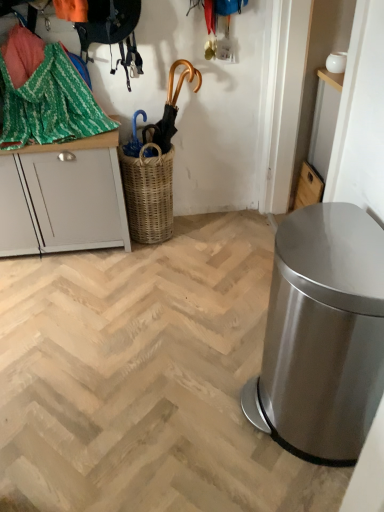
Question: From a real-world perspective, does gold metallic umbrella at upper center sit lower than green woven fabric at upper left?

Choices:
 (A) no
 (B) yes

Answer: (B)

Question: Would you say gold metallic umbrella at upper center contains green woven fabric at upper left?

Choices:
 (A) yes
 (B) no

Answer: (B)

Question: From the image's perspective, would you say gold metallic umbrella at upper center is shown under green woven fabric at upper left?

Choices:
 (A) yes
 (B) no

Answer: (A)

Question: Is gold metallic umbrella at upper center behind green woven fabric at upper left?

Choices:
 (A) yes
 (B) no

Answer: (A)

Question: Is gold metallic umbrella at upper center to the right of green woven fabric at upper left from the viewer's perspective?

Choices:
 (A) yes
 (B) no

Answer: (A)

Question: Considering the positions of satin silver trash can at right and wooden cabinet at upper right, the 2th cabinetry in the left-to-right sequence, in the image, is satin silver trash can at right taller or shorter than wooden cabinet at upper right, the 2th cabinetry in the left-to-right sequence,?

Choices:
 (A) tall
 (B) short

Answer: (A)

Question: From the image's perspective, is satin silver trash can at right located above or below wooden cabinet at upper right, the 2th cabinetry in the left-to-right sequence?

Choices:
 (A) above
 (B) below

Answer: (B)

Question: Is satin silver trash can at right in front of or behind wooden cabinet at upper right, the 2th cabinetry in the left-to-right sequence, in the image?

Choices:
 (A) front
 (B) behind

Answer: (A)

Question: Looking at their shapes, would you say satin silver trash can at right is wider or thinner than wooden cabinet at upper right, the 2th cabinetry in the left-to-right sequence?

Choices:
 (A) wide
 (B) thin

Answer: (A)

Question: Considering their positions, is woven brown basket at center located in front of or behind white painted wood cabinet at left, which is the 1th cabinetry from left to right?

Choices:
 (A) front
 (B) behind

Answer: (B)

Question: From their relative heights in the image, would you say woven brown basket at center is taller or shorter than white painted wood cabinet at left, marked as the 2th cabinetry in a right-to-left arrangement?

Choices:
 (A) tall
 (B) short

Answer: (B)

Question: Is point (152, 194) closer or farther from the camera than point (112, 207)?

Choices:
 (A) closer
 (B) farther

Answer: (B)

Question: Which is correct: woven brown basket at center is inside white painted wood cabinet at left, marked as the 2th cabinetry in a right-to-left arrangement, or outside of it?

Choices:
 (A) outside
 (B) inside

Answer: (A)

Question: From their relative heights in the image, would you say gold metallic umbrella at upper center is taller or shorter than satin silver trash can at right?

Choices:
 (A) tall
 (B) short

Answer: (B)

Question: Is gold metallic umbrella at upper center in front of or behind satin silver trash can at right in the image?

Choices:
 (A) behind
 (B) front

Answer: (A)